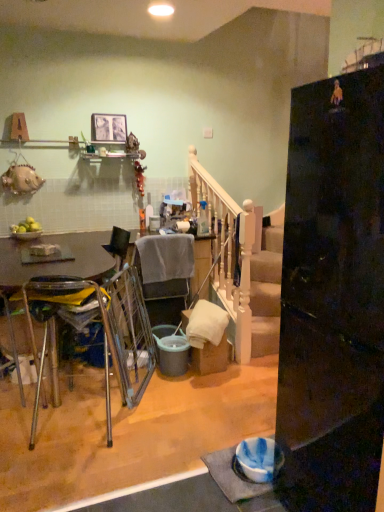
Where is `vacant space to the right of metallic silver chair at left, the 1th chair from the front`? The height and width of the screenshot is (512, 384). vacant space to the right of metallic silver chair at left, the 1th chair from the front is located at coordinates (169, 426).